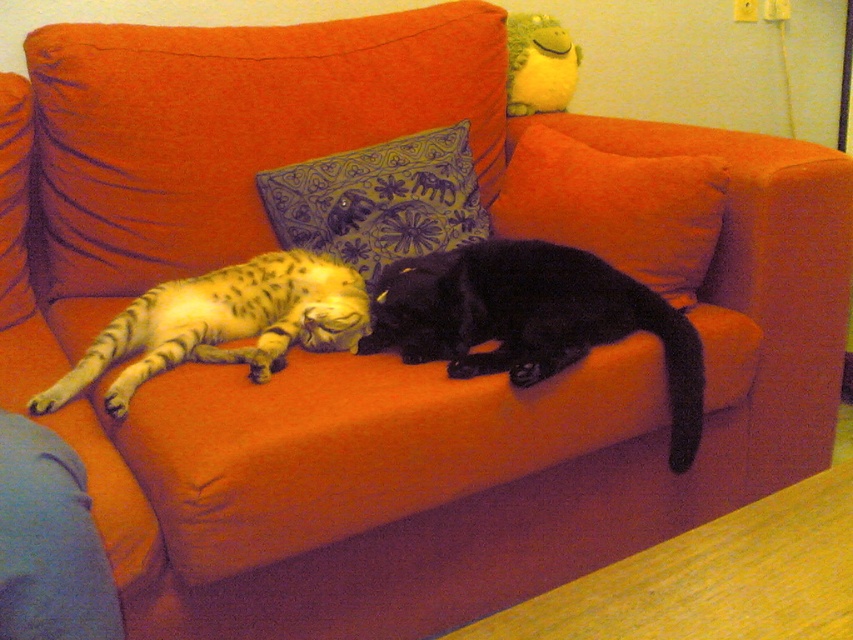
Between point (134, 301) and point (474, 198), which one is positioned in front?

Point (134, 301) is in front.

Which is behind, point (61, 392) or point (440, 172)?

Positioned behind is point (440, 172).

In order to click on tabby fur cat at center in this screenshot , I will do `click(223, 323)`.

Can you confirm if black glossy cat at center is smaller than tabby fur cat at center?

No, black glossy cat at center is not smaller than tabby fur cat at center.

Between black glossy cat at center and tabby fur cat at center, which one has less height?

tabby fur cat at center

Who is more forward, (x=416, y=362) or (x=172, y=282)?

Point (x=416, y=362)

Locate an element on the screen. The height and width of the screenshot is (640, 853). black glossy cat at center is located at coordinates (531, 320).

Can you confirm if black glossy cat at center is positioned to the right of blue embroidered pillow at center?

Indeed, black glossy cat at center is positioned on the right side of blue embroidered pillow at center.

Between black glossy cat at center and blue embroidered pillow at center, which one has more height?

black glossy cat at center is taller.

Which is in front, point (531, 362) or point (424, 188)?

Positioned in front is point (531, 362).

What are the coordinates of `black glossy cat at center` in the screenshot? It's located at (531, 320).